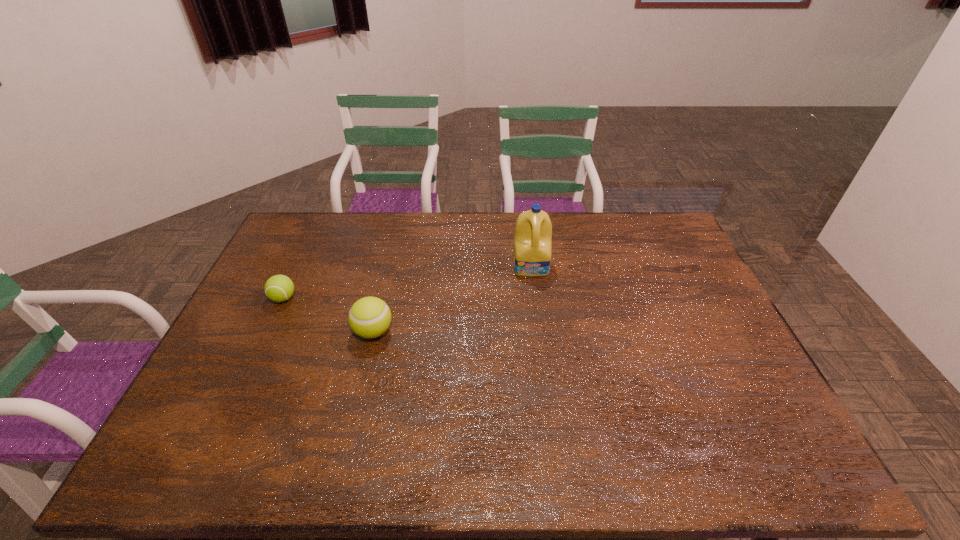
Image resolution: width=960 pixels, height=540 pixels. Identify the location of empty space that is in between the nearer tennis ball and the farther tennis ball. (328, 315).

Identify the location of vacant area that lies between the shorter tennis ball and the right tennis ball. This screenshot has height=540, width=960. (328, 315).

Locate an element on the screen. vacant space that is in between the farther tennis ball and the tallest object is located at coordinates (407, 282).

The height and width of the screenshot is (540, 960). Identify the location of vacant space that's between the shortest object and the detergent. (407, 282).

Where is `free space between the farther tennis ball and the tallest object`? This screenshot has height=540, width=960. free space between the farther tennis ball and the tallest object is located at coordinates (407, 282).

The width and height of the screenshot is (960, 540). I want to click on the closest object to the detergent, so click(369, 317).

Choose which object is the second nearest neighbor to the farthest object. Please provide its 2D coordinates. Your answer should be formatted as a tuple, i.e. [(x, y)], where the tuple contains the x and y coordinates of a point satisfying the conditions above.

[(279, 288)]